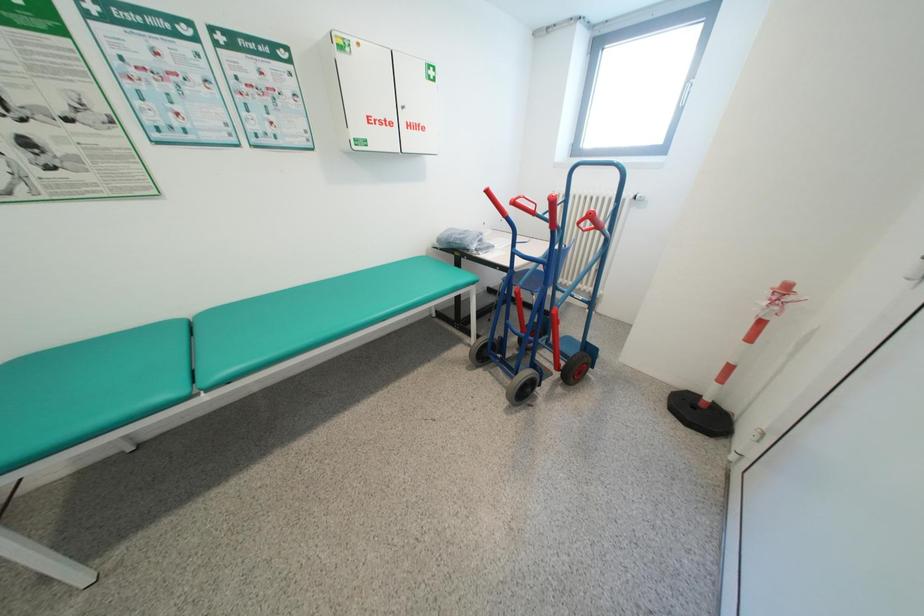
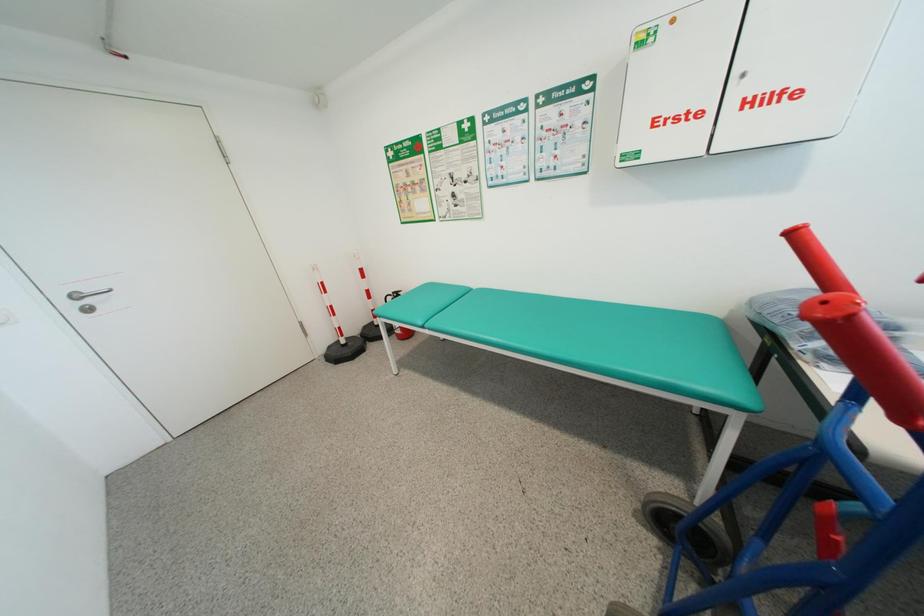
The first image is from the beginning of the video and the second image is from the end. How did the camera likely rotate when shooting the video?

The camera rotated toward left-down.